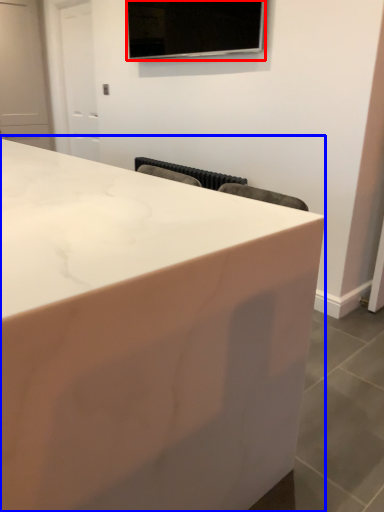
Question: Which point is further to the camera, television (highlighted by a red box) or countertop (highlighted by a blue box)?

Choices:
 (A) television
 (B) countertop

Answer: (A)